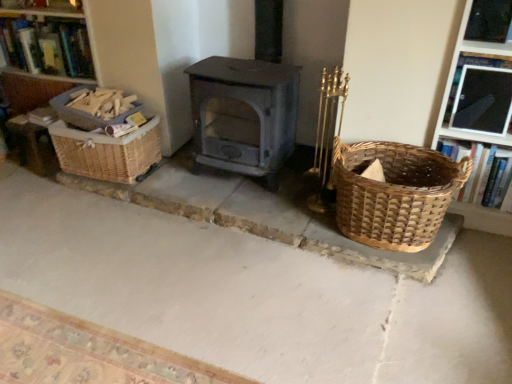
Where is `free point above woven brown basket at left, which appears as the second basket when viewed from the left (from a real-world perspective)`? This screenshot has height=384, width=512. free point above woven brown basket at left, which appears as the second basket when viewed from the left (from a real-world perspective) is located at coordinates (111, 125).